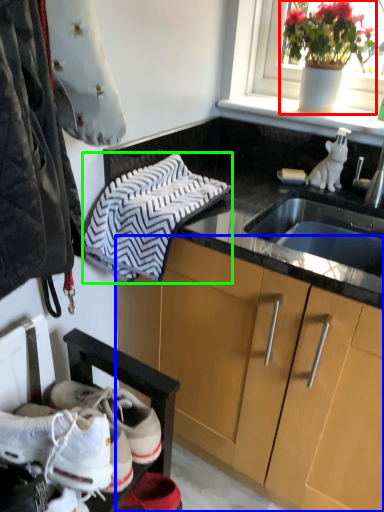
Question: Considering the real-world distances, which object is farthest from houseplant (highlighted by a red box)? cabinetry (highlighted by a blue box) or hand towel (highlighted by a green box)?

Choices:
 (A) cabinetry
 (B) hand towel

Answer: (A)